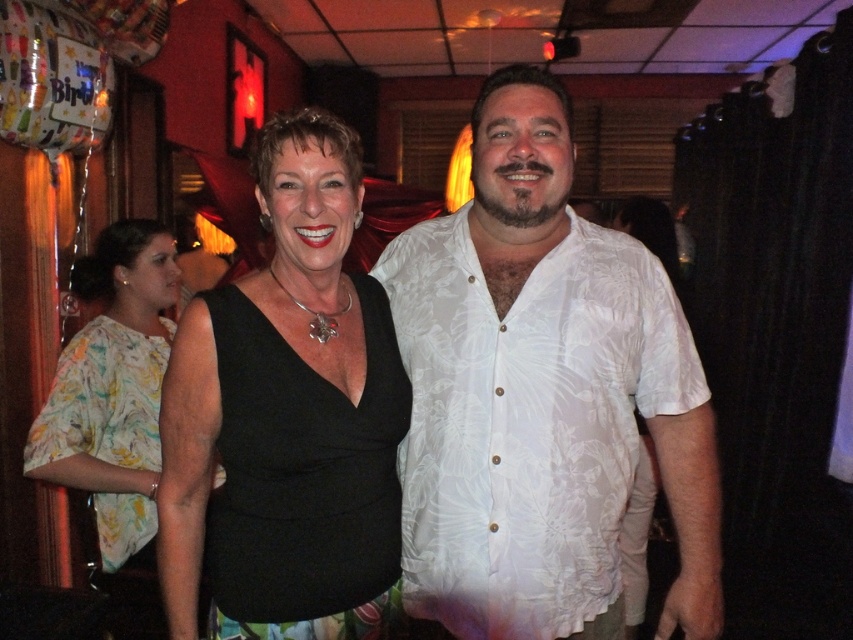
In the festive indoor scene, you see a white floral shirt at center and a black matte dress at center. From the perspective of someone facing the image, which object is positioned to the right?

The white floral shirt at center is to the right of the black matte dress at center.

You are a photographer holding a camera and want to capture a clear photo of the black matte dress at center. What is the minimum distance you should maintain between the camera and the dress to ensure the photo is in focus?

The camera and the black matte dress at center are 1.17 meters apart from each other, so the minimum distance to maintain is 1.17 meters to ensure the photo is in focus.